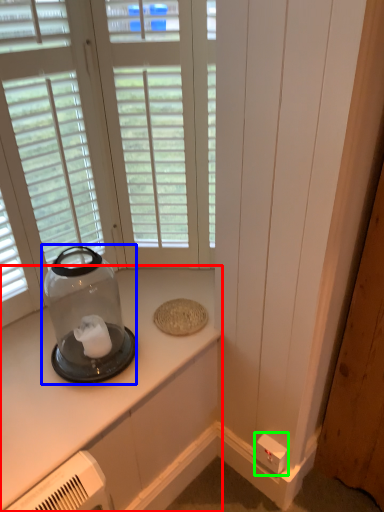
Question: Based on their relative distances, which object is farther from countertop (highlighted by a red box)? Choose from glass vase (highlighted by a blue box) and electric outlet (highlighted by a green box).

Choices:
 (A) glass vase
 (B) electric outlet

Answer: (B)